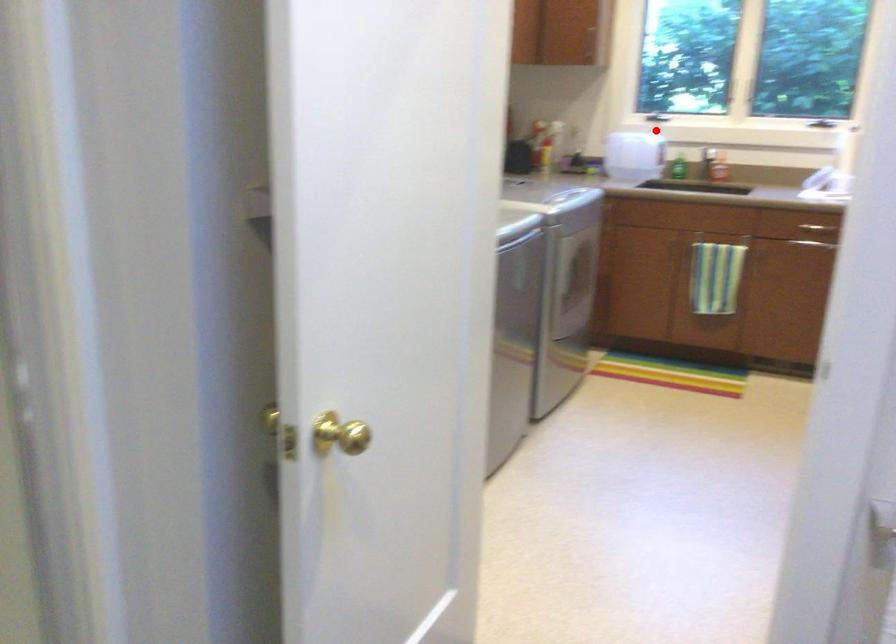
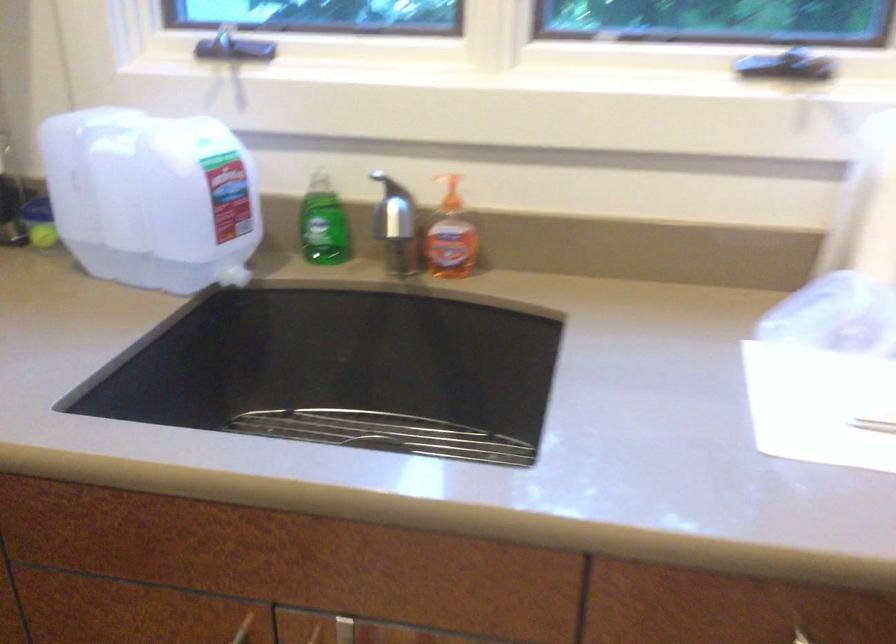
Locate, in the second image, the point that corresponds to the highlighted location in the first image.

(220, 135)